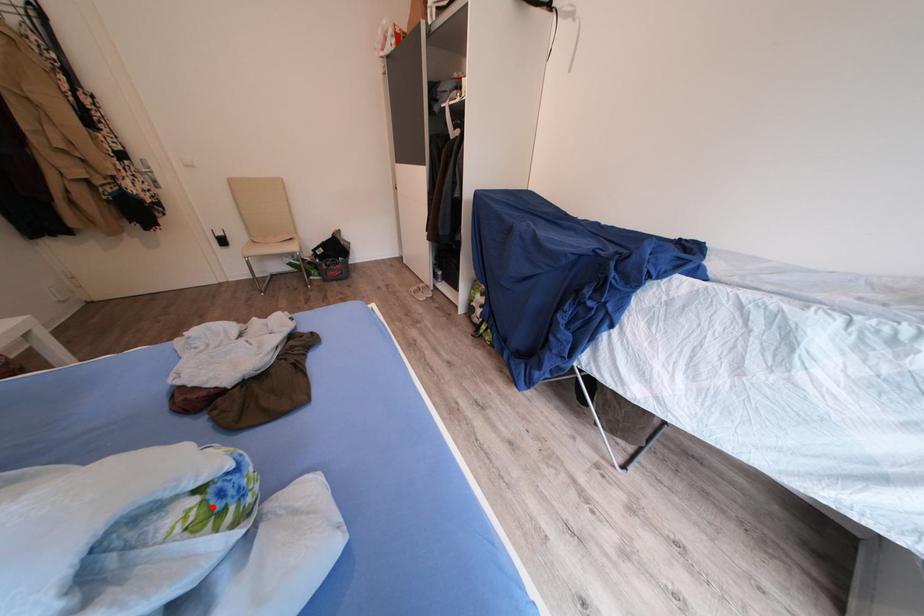
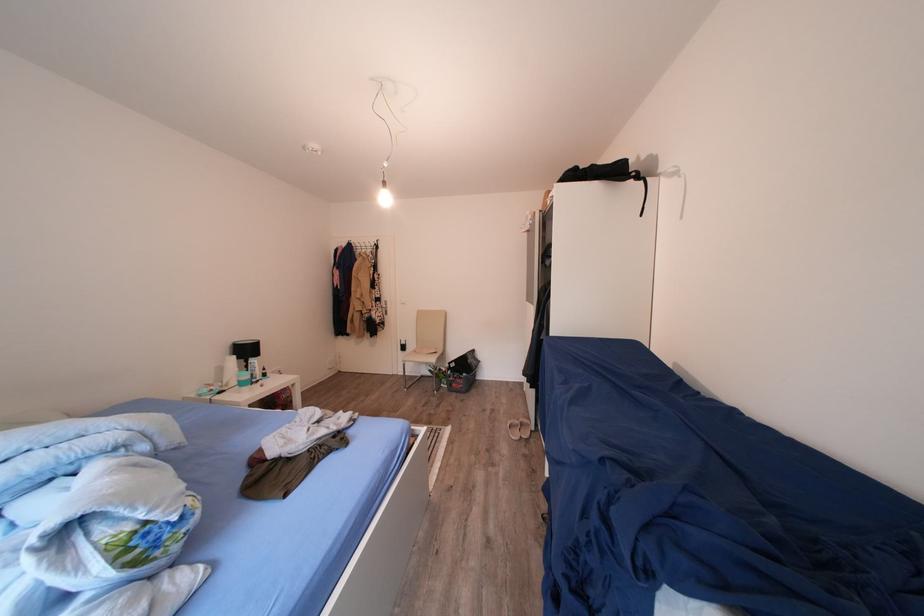
Locate, in the second image, the point that corresponds to the highlighted location in the first image.

(142, 538)